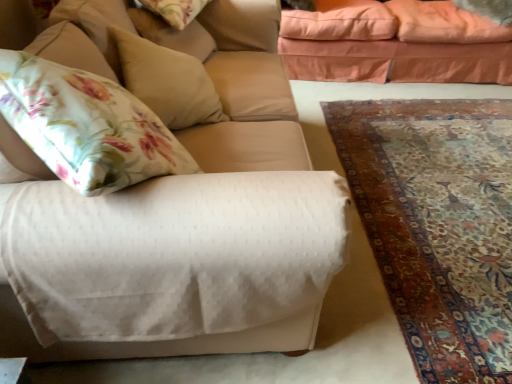
Identify the location of floral fabric pillow at upper left, marked as the second pillow in a front-to-back arrangement. (174, 10).

Describe the element at coordinates (245, 93) in the screenshot. The width and height of the screenshot is (512, 384). I see `white textured fabric couch at center, which is the 1th studio couch from front to back` at that location.

Locate an element on the screen. The image size is (512, 384). peach fabric studio couch at upper right, which is the 1th studio couch from right to left is located at coordinates (390, 46).

From a real-world perspective, which object rests below the other?

From a 3D spatial view, carpet with intricate patterns at lower right is below.

Is carpet with intricate patterns at lower right not close to beige fabric pillow at upper left, the third pillow viewed from the back?

Yes, carpet with intricate patterns at lower right and beige fabric pillow at upper left, the third pillow viewed from the back, are located far from each other.

Considering the relative positions of carpet with intricate patterns at lower right and beige fabric pillow at upper left, the second pillow when ordered from right to left, in the image provided, is carpet with intricate patterns at lower right behind beige fabric pillow at upper left, the second pillow when ordered from right to left,?

No, carpet with intricate patterns at lower right is closer to the viewer.

How many degrees apart are the facing directions of floral fabric pillow at upper left, positioned as the second pillow in bottom-to-top order, and peach fabric studio couch at upper right, which is the 1th studio couch in back-to-front order?

The angular difference between floral fabric pillow at upper left, positioned as the second pillow in bottom-to-top order, and peach fabric studio couch at upper right, which is the 1th studio couch in back-to-front order, is 72.9 degrees.

Is floral fabric pillow at upper left, positioned as the second pillow in bottom-to-top order, aimed at peach fabric studio couch at upper right, which is the 2th studio couch in front-to-back order?

No, floral fabric pillow at upper left, positioned as the second pillow in bottom-to-top order, is not oriented towards peach fabric studio couch at upper right, which is the 2th studio couch in front-to-back order.

Is point (182, 22) positioned after point (398, 49)?

No, it is in front of (398, 49).

Can we say floral fabric pillow at upper left, positioned as the second pillow in bottom-to-top order, lies outside peach fabric studio couch at upper right, which is the 1th studio couch from right to left?

Indeed, floral fabric pillow at upper left, positioned as the second pillow in bottom-to-top order, is completely outside peach fabric studio couch at upper right, which is the 1th studio couch from right to left.

Based on their sizes in the image, would you say beige fabric pillow at upper left, the third pillow viewed from the back, is bigger or smaller than carpet with intricate patterns at lower right?

In the image, beige fabric pillow at upper left, the third pillow viewed from the back, appears to be smaller than carpet with intricate patterns at lower right.

Is beige fabric pillow at upper left, placed as the 2th pillow when sorted from left to right, placed right next to carpet with intricate patterns at lower right?

They are not placed beside each other.

You are a GUI agent. You are given a task and a screenshot of the screen. Output one action in this format:
    pyautogui.click(x=<x>, y=<y>)
    Task: Click on the 1st pillow to the left when counting from the carpet with intricate patterns at lower right
    The height and width of the screenshot is (384, 512).
    Given the screenshot: What is the action you would take?
    point(167,81)

Is beige fabric pillow at upper left, the third pillow viewed from the back, taller than carpet with intricate patterns at lower right?

Yes.

Considering the sizes of objects beige fabric pillow at upper left, placed as the 2th pillow when sorted from left to right, and fluffy beige pillow at upper right, positioned as the 3th pillow in bottom-to-top order, in the image provided, who is shorter, beige fabric pillow at upper left, placed as the 2th pillow when sorted from left to right, or fluffy beige pillow at upper right, positioned as the 3th pillow in bottom-to-top order,?

fluffy beige pillow at upper right, positioned as the 3th pillow in bottom-to-top order.

How many degrees apart are the facing directions of beige fabric pillow at upper left, the third pillow viewed from the back, and fluffy beige pillow at upper right, placed as the third pillow when sorted from left to right?

114 degrees separate the facing orientations of beige fabric pillow at upper left, the third pillow viewed from the back, and fluffy beige pillow at upper right, placed as the third pillow when sorted from left to right.

Looking at this image, considering the positions of objects beige fabric pillow at upper left, the 1th pillow in the front-to-back sequence, and fluffy beige pillow at upper right, placed as the third pillow when sorted from left to right, in the image provided, who is more to the right, beige fabric pillow at upper left, the 1th pillow in the front-to-back sequence, or fluffy beige pillow at upper right, placed as the third pillow when sorted from left to right,?

fluffy beige pillow at upper right, placed as the third pillow when sorted from left to right, is more to the right.

From a real-world perspective, is beige fabric pillow at upper left, the 1th pillow in the front-to-back sequence, positioned under fluffy beige pillow at upper right, positioned as the 3th pillow in bottom-to-top order, based on gravity?

No, from a real-world perspective, beige fabric pillow at upper left, the 1th pillow in the front-to-back sequence, is not below fluffy beige pillow at upper right, positioned as the 3th pillow in bottom-to-top order.

Does white textured fabric couch at center, placed as the first studio couch when sorted from left to right, appear on the right side of carpet with intricate patterns at lower right?

In fact, white textured fabric couch at center, placed as the first studio couch when sorted from left to right, is to the left of carpet with intricate patterns at lower right.

From the image's perspective, which is above, white textured fabric couch at center, acting as the second studio couch starting from the right, or carpet with intricate patterns at lower right?

From the image's view, white textured fabric couch at center, acting as the second studio couch starting from the right, is above.

Is white textured fabric couch at center, acting as the second studio couch starting from the right, beside carpet with intricate patterns at lower right?

No, white textured fabric couch at center, acting as the second studio couch starting from the right, is not in contact with carpet with intricate patterns at lower right.

Is white textured fabric couch at center, which is the 1th studio couch from front to back, bigger or smaller than carpet with intricate patterns at lower right?

In the image, white textured fabric couch at center, which is the 1th studio couch from front to back, appears to be larger than carpet with intricate patterns at lower right.

Which is more to the left, floral fabric pillow at upper left, positioned as the second pillow in bottom-to-top order, or beige fabric pillow at upper left, the 1th pillow in the front-to-back sequence?

Positioned to the left is floral fabric pillow at upper left, positioned as the second pillow in bottom-to-top order.

Consider the image. Is floral fabric pillow at upper left, the 2th pillow when ordered from back to front, aimed at beige fabric pillow at upper left, the third pillow viewed from the back?

No.

In the scene shown: Is floral fabric pillow at upper left, the 2th pillow when ordered from back to front, touching beige fabric pillow at upper left, the 1th pillow in the front-to-back sequence?

No, floral fabric pillow at upper left, the 2th pillow when ordered from back to front, is not next to beige fabric pillow at upper left, the 1th pillow in the front-to-back sequence.

From a real-world perspective, which is physically above, floral fabric pillow at upper left, the 3th pillow when ordered from right to left, or beige fabric pillow at upper left, the second pillow when ordered from right to left?

floral fabric pillow at upper left, the 3th pillow when ordered from right to left, from a real-world perspective.

Considering the sizes of objects peach fabric studio couch at upper right, which is the 2th studio couch in front-to-back order, and fluffy beige pillow at upper right, placed as the third pillow when sorted from left to right, in the image provided, who is bigger, peach fabric studio couch at upper right, which is the 2th studio couch in front-to-back order, or fluffy beige pillow at upper right, placed as the third pillow when sorted from left to right,?

peach fabric studio couch at upper right, which is the 2th studio couch in front-to-back order, is bigger.

Can you confirm if peach fabric studio couch at upper right, arranged as the 2th studio couch when viewed from the left, is shorter than fluffy beige pillow at upper right, the first pillow viewed from the top?

Incorrect, the height of peach fabric studio couch at upper right, arranged as the 2th studio couch when viewed from the left, does not fall short of that of fluffy beige pillow at upper right, the first pillow viewed from the top.

From a real-world perspective, who is located higher, peach fabric studio couch at upper right, which is the 1th studio couch in back-to-front order, or fluffy beige pillow at upper right, positioned as the 3th pillow in bottom-to-top order?

In real-world perspective, fluffy beige pillow at upper right, positioned as the 3th pillow in bottom-to-top order, is above.

Locate an element on the screen. The width and height of the screenshot is (512, 384). the 1st pillow to the left of the carpet with intricate patterns at lower right, starting your count from the anchor is located at coordinates (167, 81).

In the image, there is a floral fabric pillow at upper left, the 3th pillow when ordered from right to left. Where is `studio couch above it (from the image's perspective)`? The width and height of the screenshot is (512, 384). studio couch above it (from the image's perspective) is located at coordinates (390, 46).

Estimate the real-world distances between objects in this image. Which object is closer to fluffy beige pillow at upper right, marked as the 1th pillow in a back-to-front arrangement, white textured fabric couch at center, placed as the first studio couch when sorted from left to right, or beige fabric pillow at upper left, placed as the 2th pillow when sorted from left to right?

The object closer to fluffy beige pillow at upper right, marked as the 1th pillow in a back-to-front arrangement, is white textured fabric couch at center, placed as the first studio couch when sorted from left to right.

When comparing their distances from white textured fabric couch at center, placed as the first studio couch when sorted from left to right, does carpet with intricate patterns at lower right or floral fabric pillow at upper left, which is the 2th pillow in top-to-bottom order, seem closer?

The object closer to white textured fabric couch at center, placed as the first studio couch when sorted from left to right, is floral fabric pillow at upper left, which is the 2th pillow in top-to-bottom order.

Based on their spatial positions, is white textured fabric couch at center, which is the 1th studio couch from front to back, or carpet with intricate patterns at lower right closer to beige fabric pillow at upper left, which is the 3th pillow from top to bottom?

white textured fabric couch at center, which is the 1th studio couch from front to back, is closer to beige fabric pillow at upper left, which is the 3th pillow from top to bottom.

Estimate the real-world distances between objects in this image. Which object is further from floral fabric pillow at upper left, positioned as the second pillow in bottom-to-top order, peach fabric studio couch at upper right, which is the 1th studio couch from right to left, or beige fabric pillow at upper left, the second pillow when ordered from right to left?

The object further to floral fabric pillow at upper left, positioned as the second pillow in bottom-to-top order, is peach fabric studio couch at upper right, which is the 1th studio couch from right to left.

Based on their spatial positions, is beige fabric pillow at upper left, the second pillow when ordered from right to left, or floral fabric pillow at upper left, marked as the second pillow in a front-to-back arrangement, closer to peach fabric studio couch at upper right, which is the 1th studio couch from right to left?

Based on the image, floral fabric pillow at upper left, marked as the second pillow in a front-to-back arrangement, appears to be nearer to peach fabric studio couch at upper right, which is the 1th studio couch from right to left.

Based on their spatial positions, is floral fabric pillow at upper left, which is the 2th pillow in top-to-bottom order, or white textured fabric couch at center, placed as the first studio couch when sorted from left to right, further from peach fabric studio couch at upper right, which is the 2th studio couch in front-to-back order?

floral fabric pillow at upper left, which is the 2th pillow in top-to-bottom order, is further to peach fabric studio couch at upper right, which is the 2th studio couch in front-to-back order.

Estimate the real-world distances between objects in this image. Which object is closer to beige fabric pillow at upper left, the 1th pillow in the front-to-back sequence, white textured fabric couch at center, which is the 1th studio couch from front to back, or floral fabric pillow at upper left, which is the 2th pillow in top-to-bottom order?

Based on the image, white textured fabric couch at center, which is the 1th studio couch from front to back, appears to be nearer to beige fabric pillow at upper left, the 1th pillow in the front-to-back sequence.

When comparing their distances from floral fabric pillow at upper left, the 2th pillow when ordered from back to front, does fluffy beige pillow at upper right, which is the first pillow in right-to-left order, or beige fabric pillow at upper left, the 1th pillow in the front-to-back sequence, seem closer?

Based on the image, beige fabric pillow at upper left, the 1th pillow in the front-to-back sequence, appears to be nearer to floral fabric pillow at upper left, the 2th pillow when ordered from back to front.

The image size is (512, 384). I want to click on pillow between floral fabric pillow at upper left, the 2th pillow when ordered from back to front, and peach fabric studio couch at upper right, which is the 1th studio couch from right to left, in the horizontal direction, so click(x=167, y=81).

This screenshot has width=512, height=384. What are the coordinates of `mat between floral fabric pillow at upper left, the 2th pillow when ordered from back to front, and fluffy beige pillow at upper right, marked as the 1th pillow in a back-to-front arrangement, from left to right` in the screenshot? It's located at (437, 224).

At what (x,y) coordinates should I click in order to perform the action: click on mat between beige fabric pillow at upper left, which ranks as the 1th pillow in bottom-to-top order, and fluffy beige pillow at upper right, positioned as the 3th pillow in bottom-to-top order, in the horizontal direction. Please return your answer as a coordinate pair (x, y). Looking at the image, I should click on (437, 224).

Image resolution: width=512 pixels, height=384 pixels. What are the coordinates of `studio couch located between white textured fabric couch at center, which is the 1th studio couch from front to back, and fluffy beige pillow at upper right, the first pillow viewed from the top, in the depth direction` in the screenshot? It's located at (390, 46).